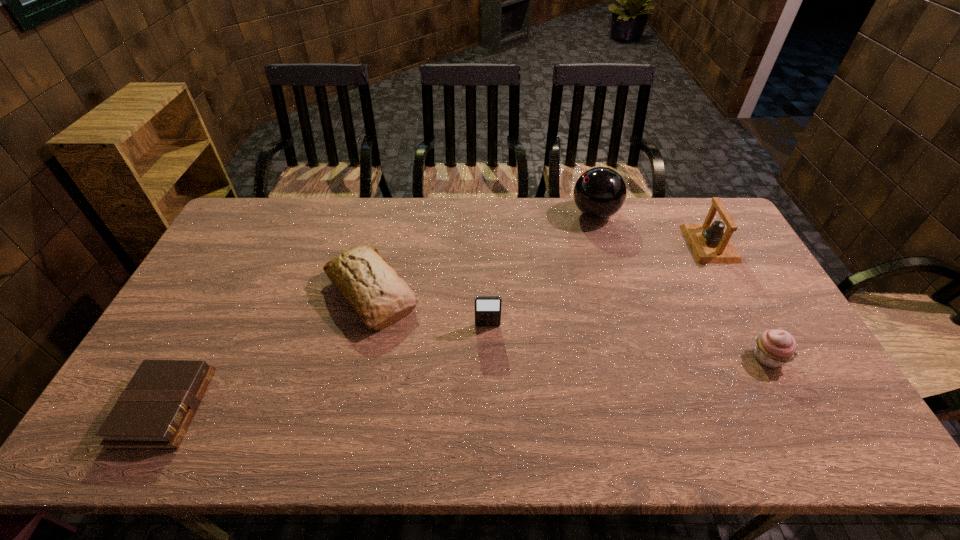
This screenshot has width=960, height=540. I want to click on unoccupied position between the Bible and the cupcake, so click(467, 382).

You are a GUI agent. You are given a task and a screenshot of the screen. Output one action in this format:
    pyautogui.click(x=<x>, y=<y>)
    Task: Click on the free space between the fifth object from right to left and the fourth object from right to left
    
    Given the screenshot: What is the action you would take?
    pyautogui.click(x=430, y=309)

The height and width of the screenshot is (540, 960). Identify the location of vacant area between the Bible and the cupcake. (467, 382).

Locate an element on the screen. free spot between the cupcake and the leftmost object is located at coordinates point(467,382).

The width and height of the screenshot is (960, 540). Identify the location of empty location between the bowling ball and the bell. (652, 229).

I want to click on free spot between the tallest object and the bell, so click(652, 229).

The width and height of the screenshot is (960, 540). I want to click on empty space that is in between the cupcake and the leftmost object, so click(x=467, y=382).

Find the location of a particular element. vacant area that lies between the fourth object from left to right and the iPod is located at coordinates (541, 269).

The image size is (960, 540). In order to click on object that ranks as the third closest to the fourth object from right to left in this screenshot , I will do `click(774, 348)`.

Locate an element on the screen. the closest object relative to the second object from left to right is located at coordinates (487, 308).